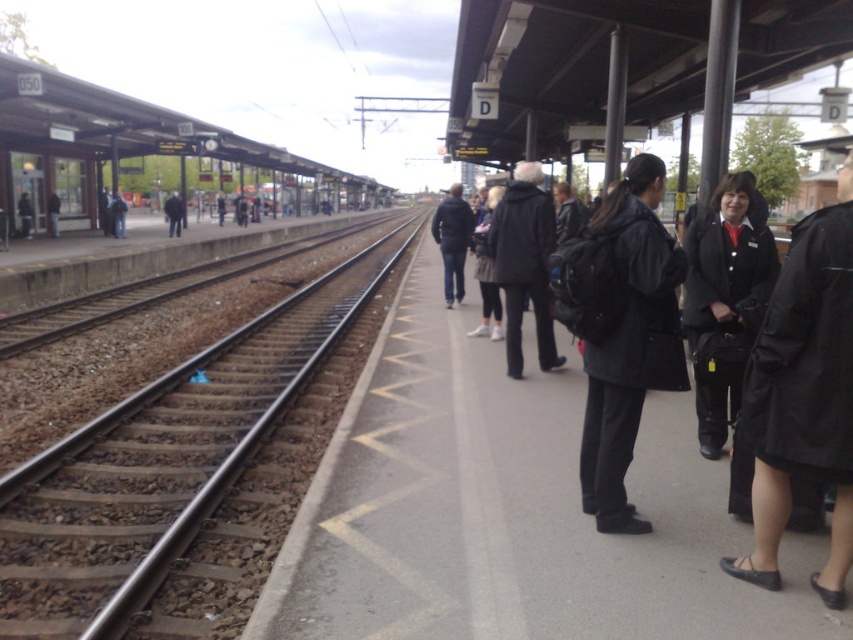
Consider the image. You are a passenger on the platform and want to ensure your black matte coat at right doesn not get dirty from the smooth steel tracks at center. Should you move your coat away from the tracks?

The smooth steel tracks at center are above the black matte coat at right, so the coat is below the tracks. Since the tracks are overhead, moving the coat away from the tracks would prevent it from getting dirty from any debris or water dripping down from the tracks.

You are standing on the platform and want to ensure you stay within the safe area marked by the yellow zigzag lines. Where should you position yourself relative to the smooth steel tracks at center?

To stay within the safe area marked by the yellow zigzag lines, you should position yourself away from the smooth steel tracks at center, as the tracks are located at point (175, 468), which is likely near the edge of the platform where the safe area ends.